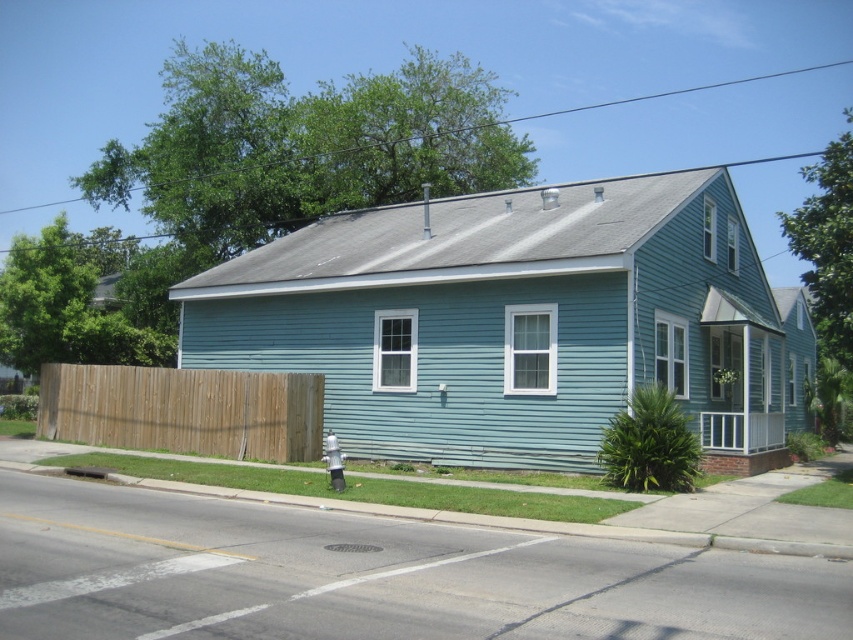
Question: Where is brown wooden fence at lower left located in relation to gray concrete curb at lower center in the image?

Choices:
 (A) above
 (B) below

Answer: (A)

Question: Which object appears farthest from the camera in this image?

Choices:
 (A) gray concrete curb at lower center
 (B) brown wooden fence at lower left

Answer: (B)

Question: Is brown wooden fence at lower left to the right of gray concrete curb at lower center from the viewer's perspective?

Choices:
 (A) no
 (B) yes

Answer: (A)

Question: Which of the following is the farthest from the observer?

Choices:
 (A) gray concrete curb at lower center
 (B) brown wooden fence at lower left

Answer: (B)

Question: Does brown wooden fence at lower left have a larger size compared to gray concrete curb at lower center?

Choices:
 (A) no
 (B) yes

Answer: (B)